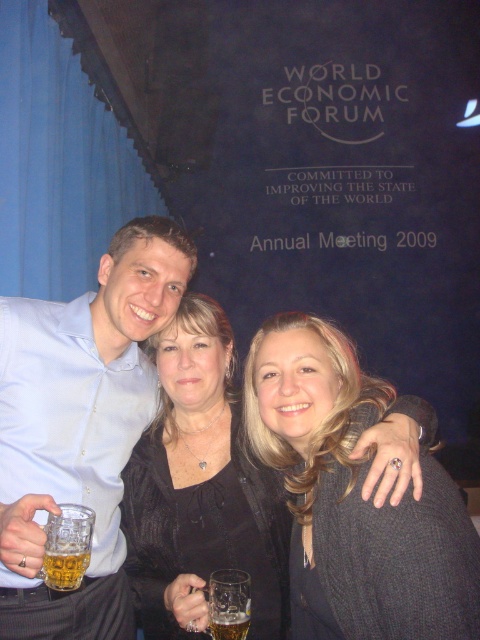
Can you confirm if black fabric at center is taller than translucent glass at lower center?

Yes, black fabric at center is taller than translucent glass at lower center.

What do you see at coordinates (201, 483) in the screenshot? The width and height of the screenshot is (480, 640). I see `black fabric at center` at bounding box center [201, 483].

Identify the location of black fabric at center. This screenshot has height=640, width=480. (201, 483).

Can you confirm if matte blue shirt at center is taller than black fabric at center?

Indeed, matte blue shirt at center has a greater height compared to black fabric at center.

Is matte blue shirt at center wider than black fabric at center?

Incorrect, matte blue shirt at center's width does not surpass black fabric at center's.

Who is more forward, (36, 563) or (149, 506)?

Point (36, 563) is in front.

In order to click on matte blue shirt at center in this screenshot , I will do `click(81, 426)`.

Which is in front, point (82, 321) or point (80, 552)?

Point (80, 552)

Which is behind, point (402, 438) or point (46, 544)?

Point (402, 438)

Identify the location of matte black dress at center. The height and width of the screenshot is (640, 480). (83, 388).